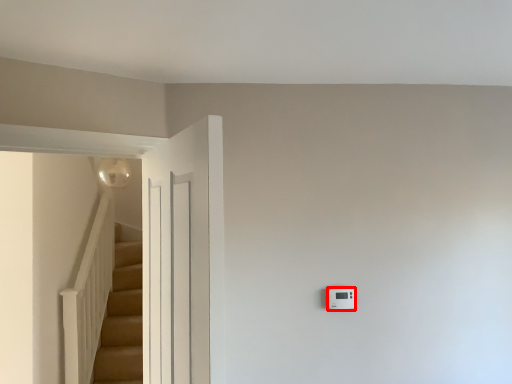
Question: In this image, where is light switch (annotated by the red box) located relative to door?

Choices:
 (A) left
 (B) right

Answer: (B)